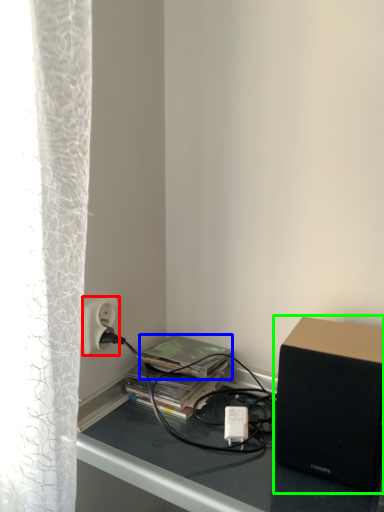
Question: Which object is the farthest from power outlet (highlighted by a red box)? Choose among these: paperback book (highlighted by a blue box) or loudspeaker (highlighted by a green box).

Choices:
 (A) paperback book
 (B) loudspeaker

Answer: (B)